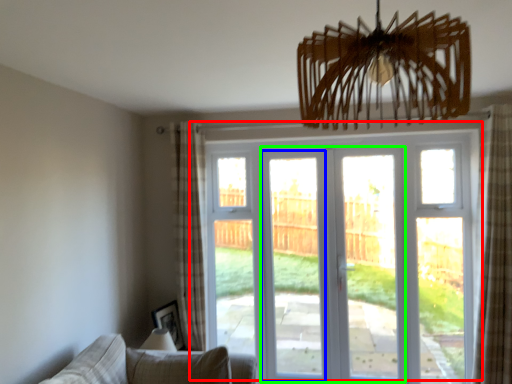
Question: Which object is positioned closest to door (highlighted by a red box)? Select from screen door (highlighted by a blue box) and screen door (highlighted by a green box).

Choices:
 (A) screen door
 (B) screen door

Answer: (A)